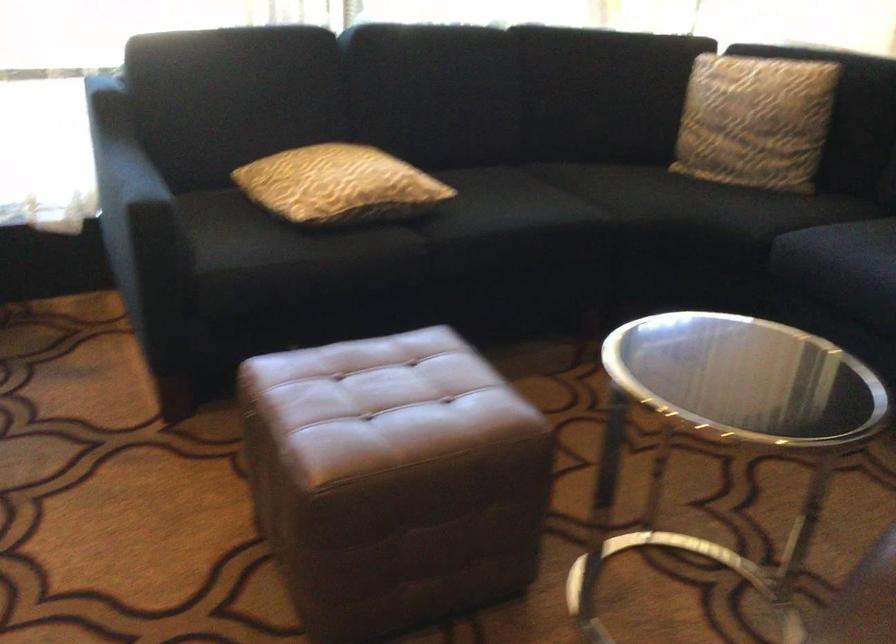
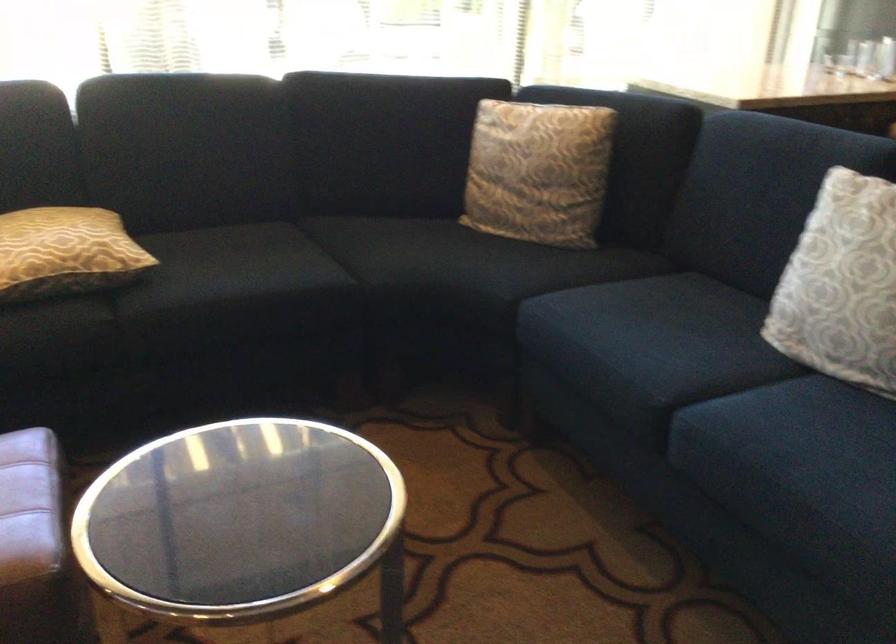
Question: I am providing you with two images of the same scene from different viewpoints. Please identify which objects are invisible in image2.

Choices:
 (A) sofa sitting surface
 (B) patterned grey pillow
 (C) patterned brown pillow
 (D) none of these

Answer: (D)